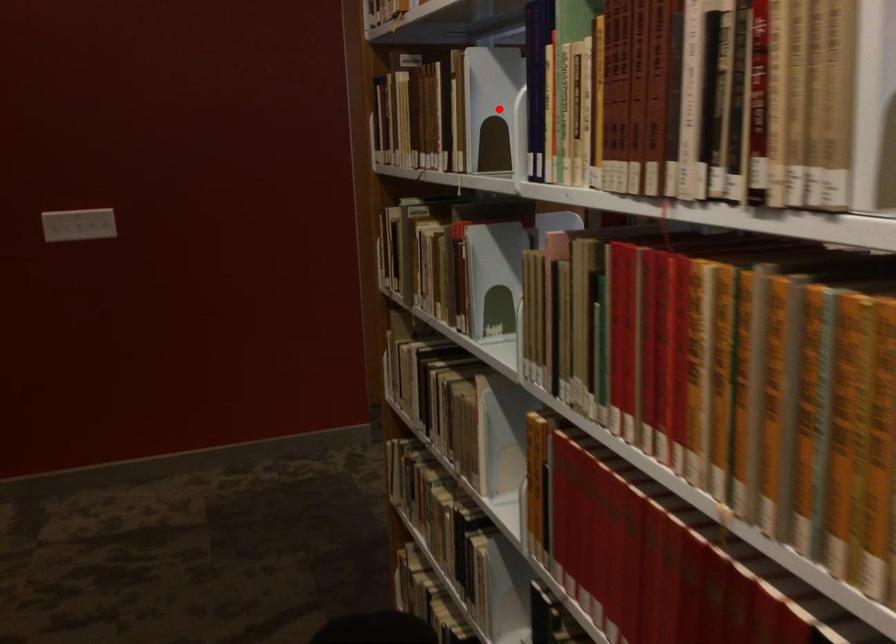
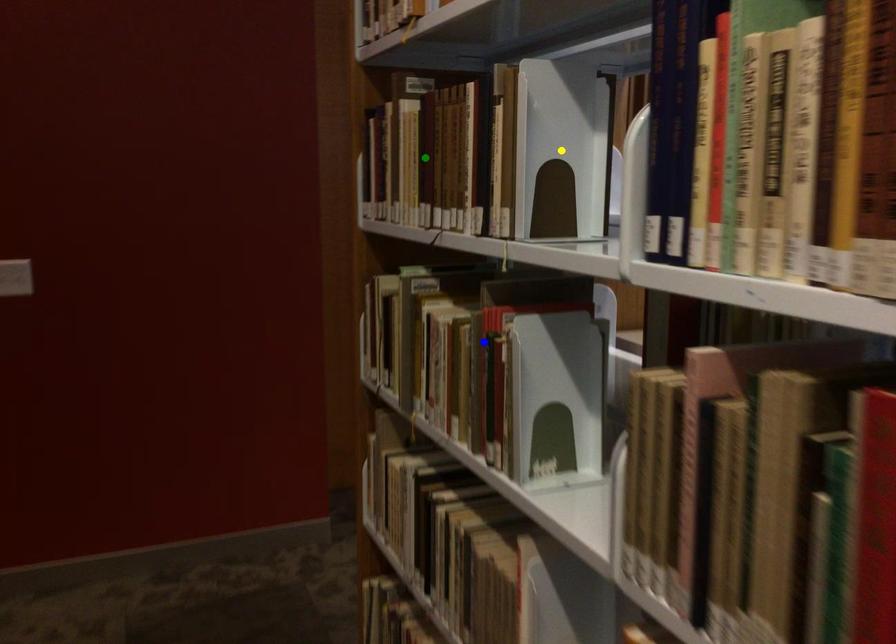
Question: I am providing you with two images of the same scene from different viewpoints. A red point is marked on the first image. You are given multiple points on the second image. Which spot in image 2 lines up with the point in image 1?

Choices:
 (A) blue point
 (B) green point
 (C) yellow point

Answer: (C)